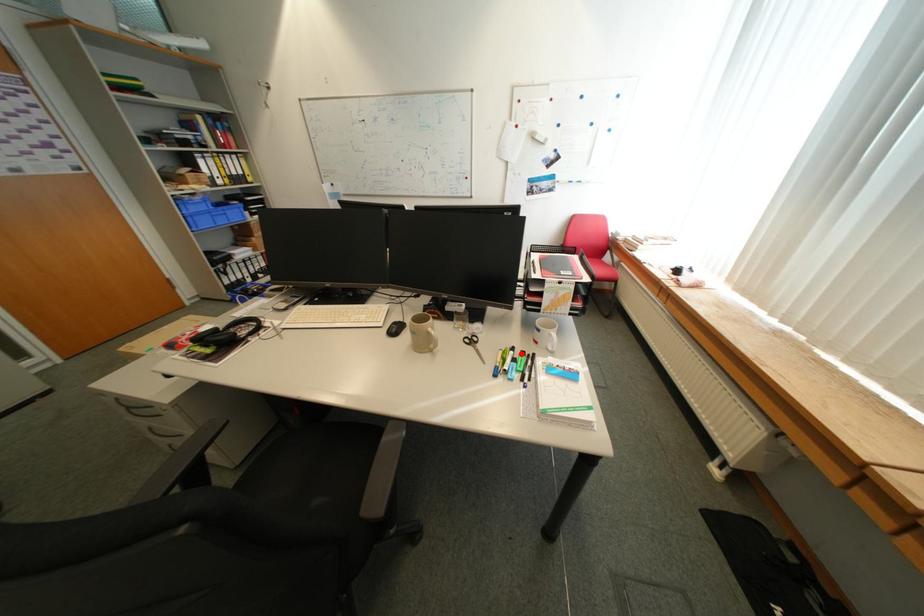
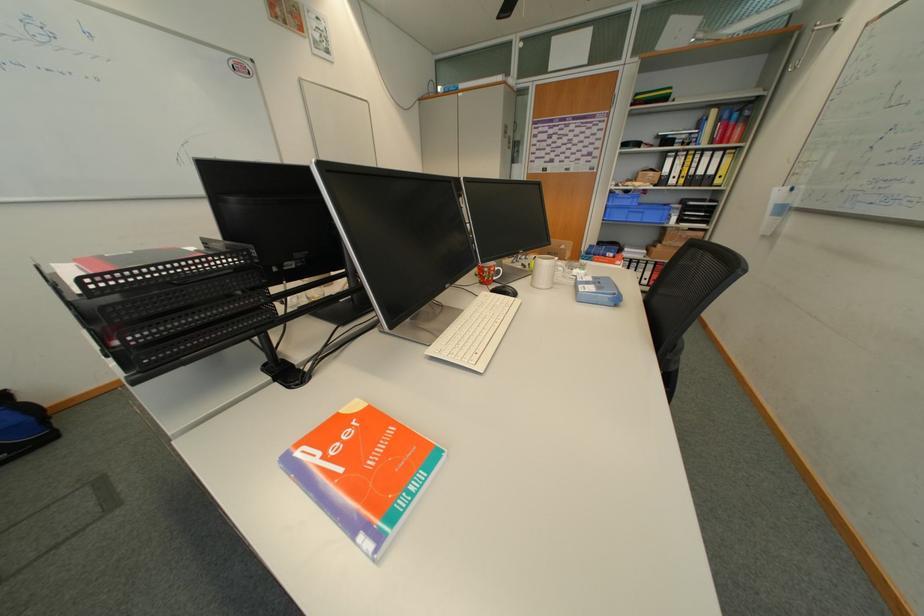
Question: I am providing you with two images of the same scene from different viewpoints. A red point is marked on the first image. At the location where the point appears in image 1, is it still visible in image 2?

Choices:
 (A) Yes
 (B) No

Answer: (B)